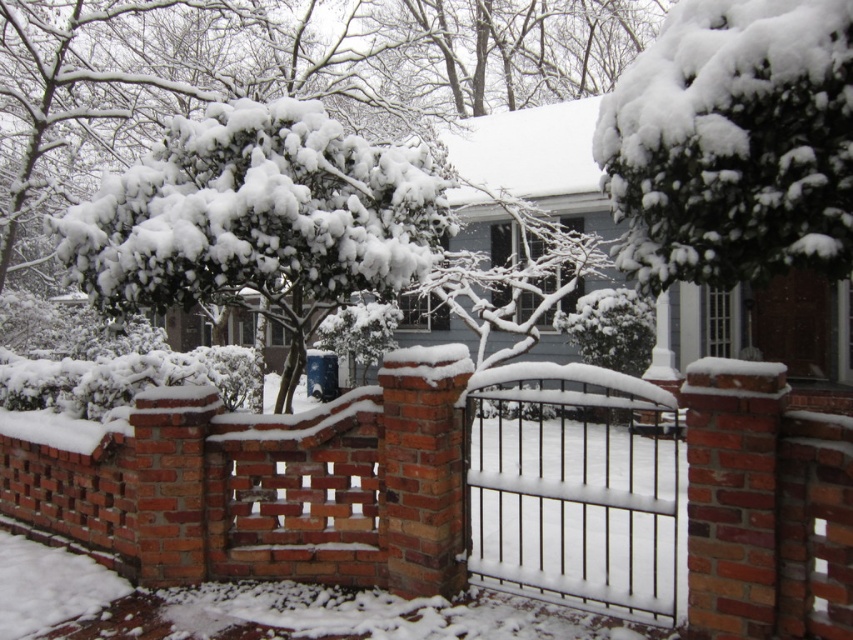
This screenshot has width=853, height=640. I want to click on brick wall at center, so click(376, 486).

Looking at this image, does brick wall at center have a smaller size compared to green textured bush at upper right?

Indeed, brick wall at center has a smaller size compared to green textured bush at upper right.

Is point (326, 410) closer to camera compared to point (784, 19)?

That is False.

The height and width of the screenshot is (640, 853). I want to click on brick wall at center, so click(376, 486).

Is green textured bush at upper right further to camera compared to snow-covered branches at center?

No, it is in front of snow-covered branches at center.

Is green textured bush at upper right above snow-covered branches at center?

Yes, green textured bush at upper right is above snow-covered branches at center.

You are a GUI agent. You are given a task and a screenshot of the screen. Output one action in this format:
    pyautogui.click(x=<x>, y=<y>)
    Task: Click on the green textured bush at upper right
    The image size is (853, 640).
    Given the screenshot: What is the action you would take?
    733,144

Is brick wall at center bigger than snow-covered branches at center?

No.

Can you confirm if brick wall at center is positioned above snow-covered branches at center?

Incorrect, brick wall at center is not positioned above snow-covered branches at center.

Does point (256, 554) come behind point (136, 221)?

No, it is in front of (136, 221).

Locate an element on the screen. The height and width of the screenshot is (640, 853). brick wall at center is located at coordinates (376, 486).